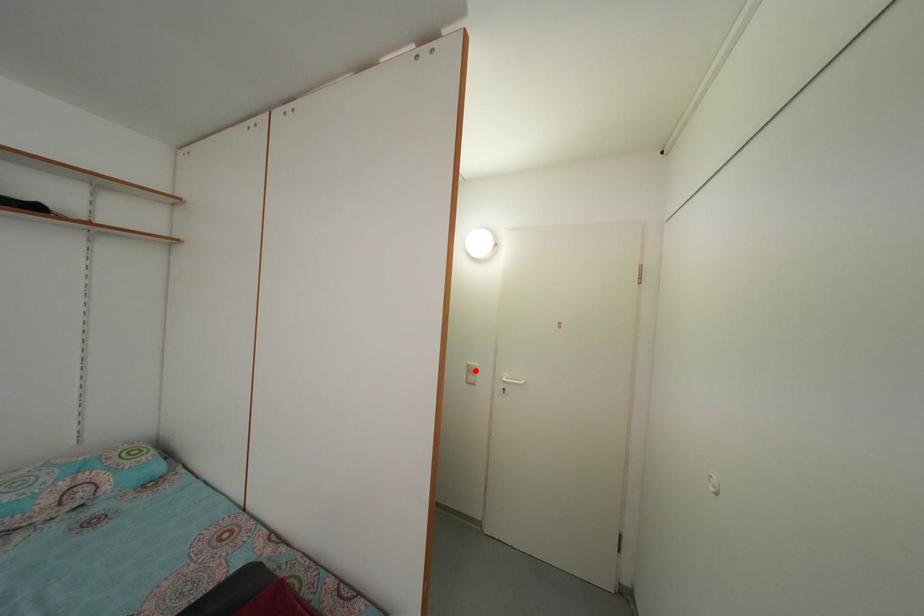
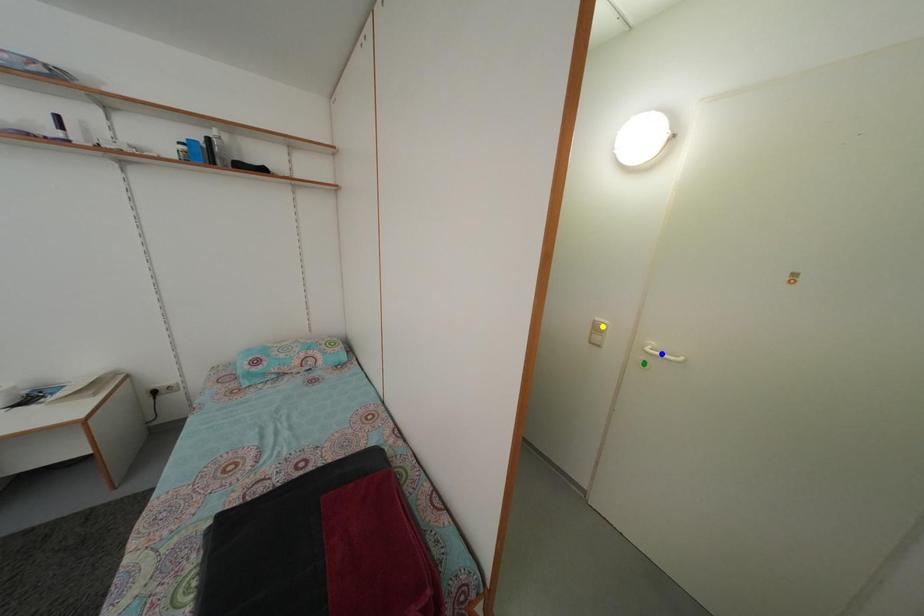
Question: I am providing you with two images of the same scene from different viewpoints. A red point is marked on the first image. You are given multiple points on the second image. In image 2, which mark is for the same physical point as the one in image 1?

Choices:
 (A) blue point
 (B) green point
 (C) yellow point

Answer: (C)